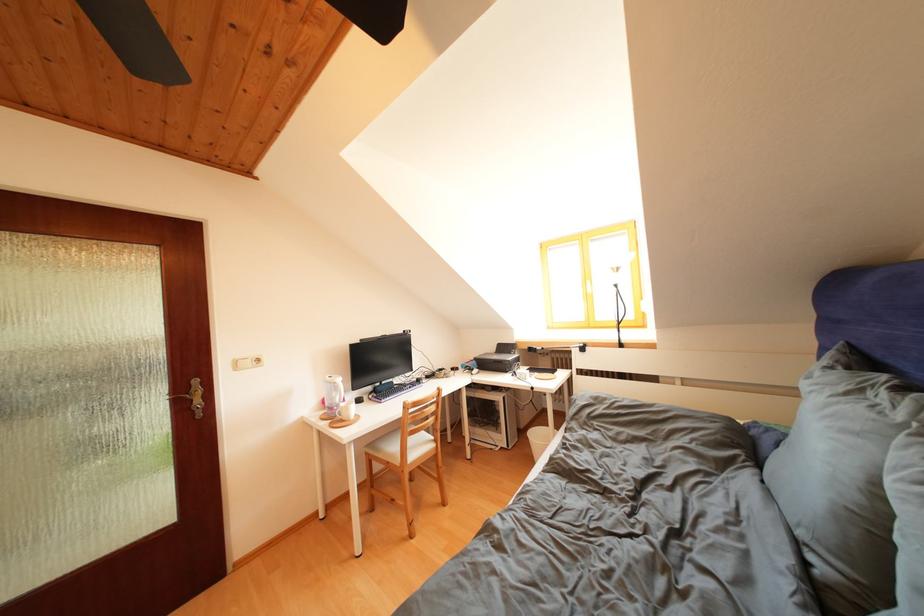
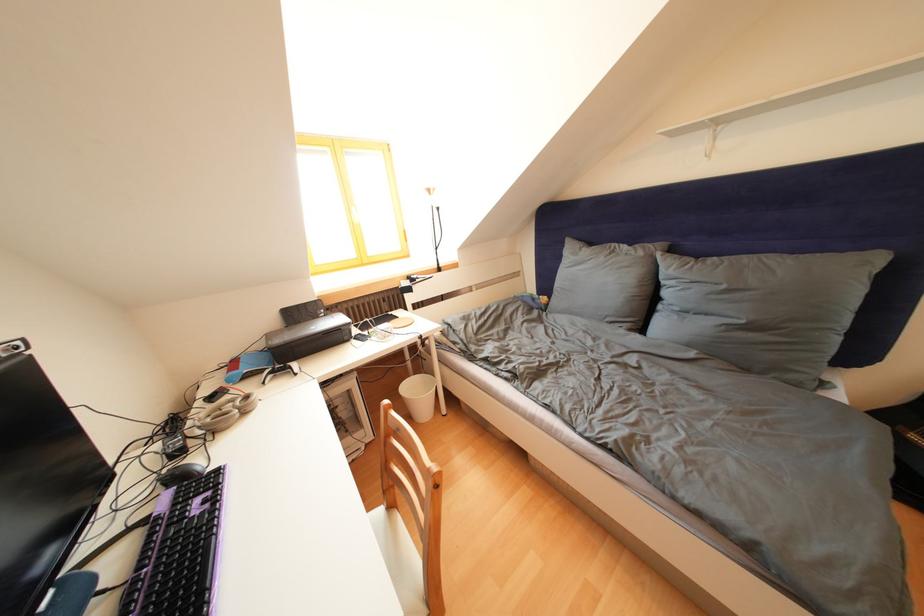
Find the pixel in the second image that matches point 460,374 in the first image.

(220, 403)